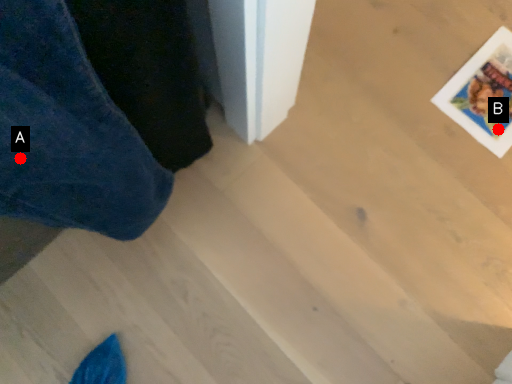
Question: Two points are circled on the image, labeled by A and B beside each circle. Which point is closer to the camera taking this photo?

Choices:
 (A) A is closer
 (B) B is closer

Answer: (A)